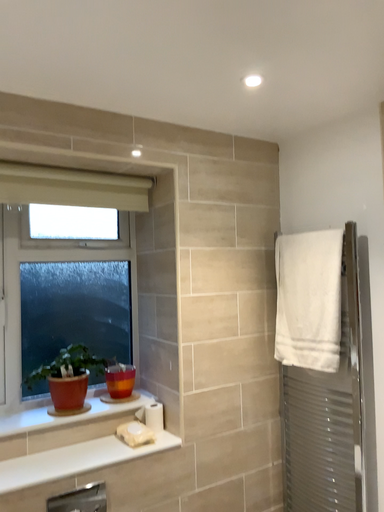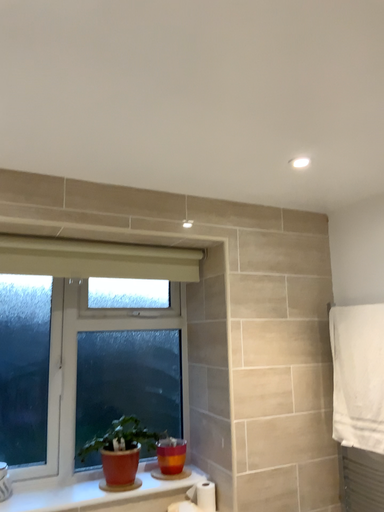
Question: Which way did the camera rotate in the video?

Choices:
 (A) rotated downward
 (B) rotated upward

Answer: (B)